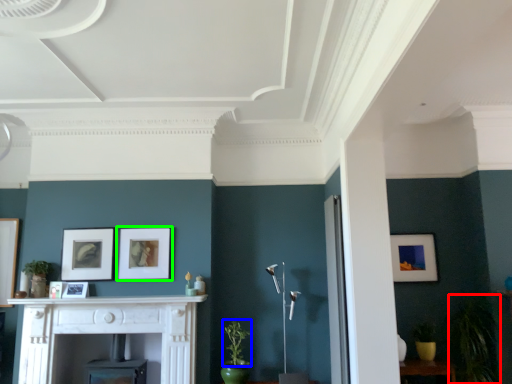
Question: Which object is the closest to the plant (highlighted by a red box)? Choose among these: plant (highlighted by a blue box) or picture frame (highlighted by a green box).

Choices:
 (A) plant
 (B) picture frame

Answer: (A)